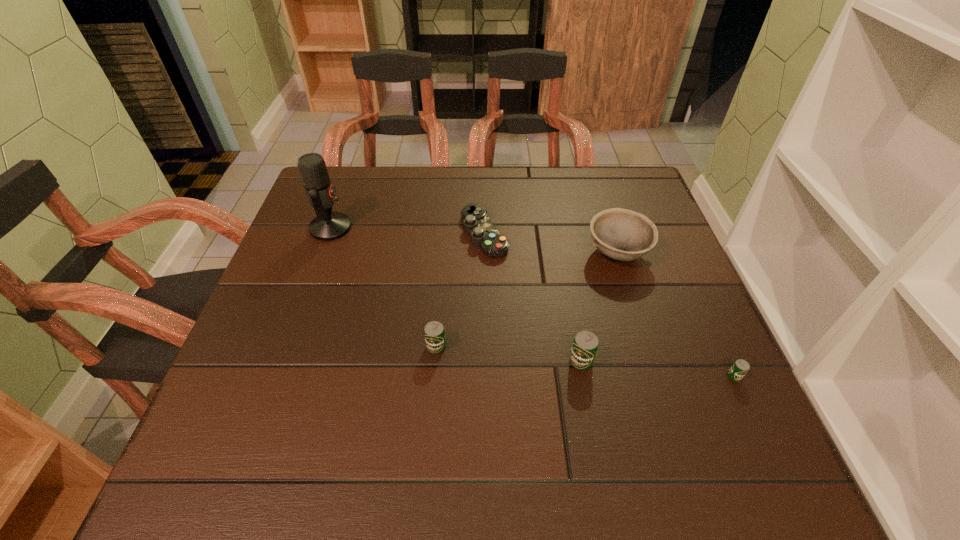
The height and width of the screenshot is (540, 960). In order to click on empty space that is in between the second beer can from right to left and the leftmost beer can in this screenshot , I will do `click(509, 354)`.

Identify the location of free point between the bowl and the second shortest beer can. (527, 300).

Where is `free space between the second beer can from left to right and the leftmost object`? free space between the second beer can from left to right and the leftmost object is located at coordinates (456, 294).

Identify the location of empty location between the rightmost object and the bowl. This screenshot has height=540, width=960. (676, 315).

What are the coordinates of `free spot between the second tallest beer can and the second beer can from left to right` in the screenshot? It's located at (x=509, y=354).

Select which object is the fifth closest to the fourth tallest object. Please provide its 2D coordinates. Your answer should be formatted as a tuple, i.e. [(x, y)], where the tuple contains the x and y coordinates of a point satisfying the conditions above.

[(739, 369)]

You are a GUI agent. You are given a task and a screenshot of the screen. Output one action in this format:
    pyautogui.click(x=<x>, y=<y>)
    Task: Click on the object that can be found as the closest to the rightmost object
    Image resolution: width=960 pixels, height=540 pixels.
    Given the screenshot: What is the action you would take?
    pyautogui.click(x=585, y=345)

I want to click on beer can that is the closest to the second beer can from left to right, so click(x=434, y=332).

I want to click on the second closest beer can to the second beer can from right to left, so (739, 369).

In order to click on blank space that satisfies the following two spatial constraints: 1. on the side of the leftmost object with the red ring; 2. on the left side of the bowl in this screenshot , I will do `click(322, 253)`.